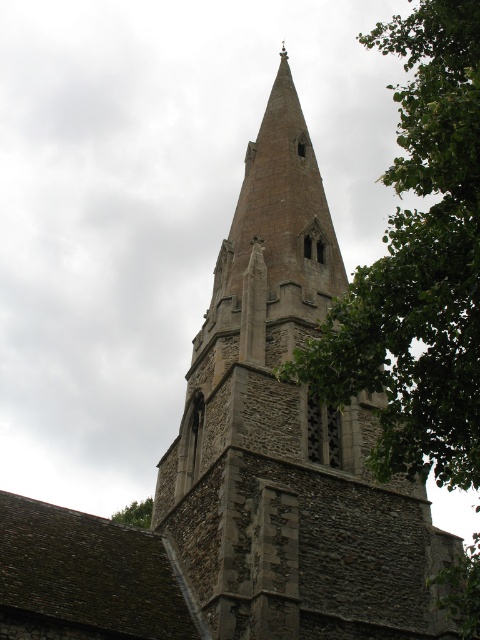
Question: Can you confirm if green leafy tree at upper right is wider than green leafy tree at lower left?

Choices:
 (A) no
 (B) yes

Answer: (B)

Question: Can you confirm if green leafy tree at upper right is positioned to the left of green leafy tree at lower left?

Choices:
 (A) yes
 (B) no

Answer: (B)

Question: Is the position of green leafy tree at upper right less distant than that of green leafy tree at lower left?

Choices:
 (A) yes
 (B) no

Answer: (A)

Question: Which object is farther from the camera taking this photo?

Choices:
 (A) green leafy tree at lower left
 (B) green leafy tree at upper right

Answer: (A)